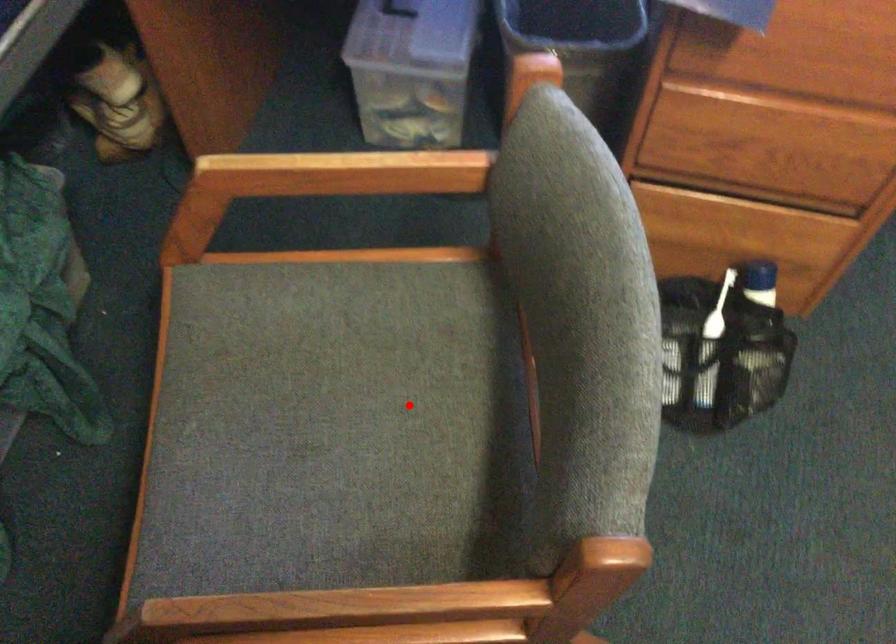
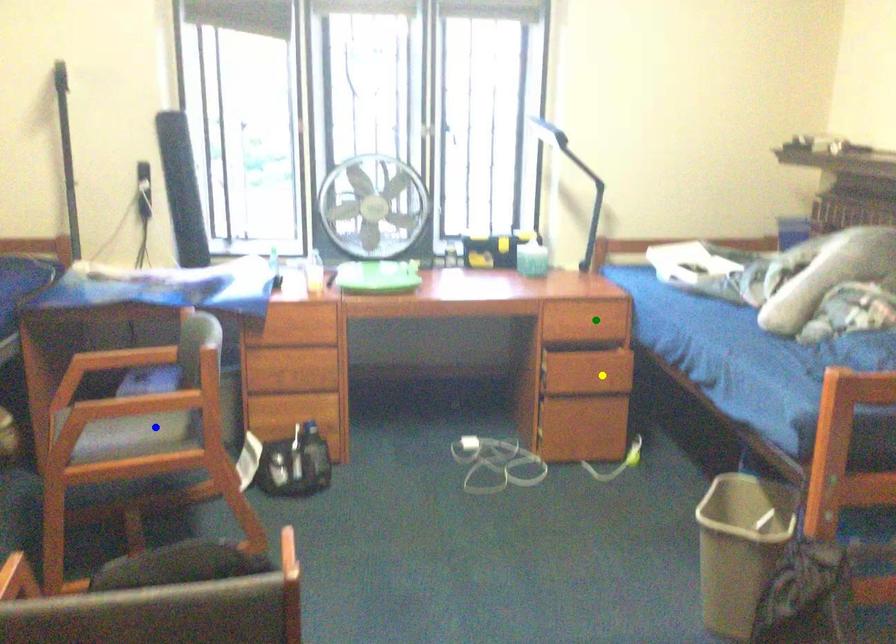
Question: I am providing you with two images of the same scene from different viewpoints. A red point is marked on the first image. You are given multiple points on the second image. In image 2, which mark is for the same physical point as the one in image 1?

Choices:
 (A) blue point
 (B) yellow point
 (C) green point

Answer: (A)